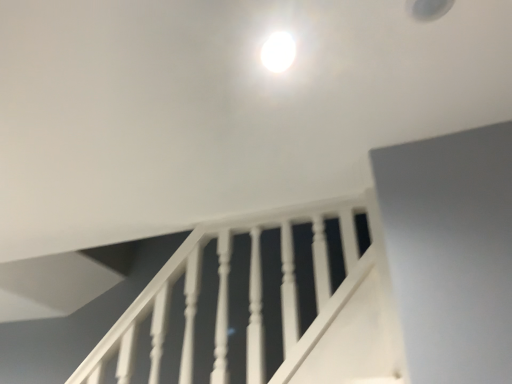
What do you see at coordinates (278, 52) in the screenshot?
I see `white glossy light at upper center` at bounding box center [278, 52].

Where is `white glossy light at upper center`? The width and height of the screenshot is (512, 384). white glossy light at upper center is located at coordinates (278, 52).

In order to face white glossy light at upper center, should I rotate leftwards or rightwards?

You should rotate right by 3.680 degrees.

I want to click on white glossy light at upper center, so click(x=278, y=52).